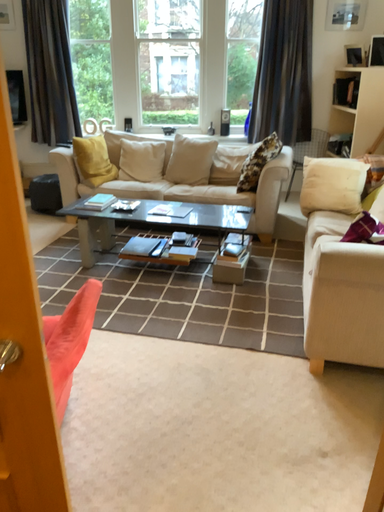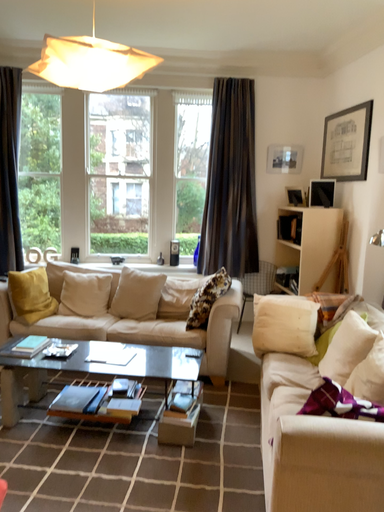
Question: Which way did the camera rotate in the video?

Choices:
 (A) rotated left
 (B) rotated right

Answer: (B)